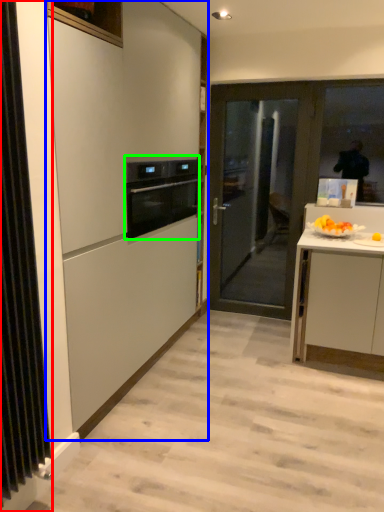
Question: Considering the real-world distances, which object is farthest from radiator (highlighted by a red box)? cabinetry (highlighted by a blue box) or kitchen appliance (highlighted by a green box)?

Choices:
 (A) cabinetry
 (B) kitchen appliance

Answer: (B)